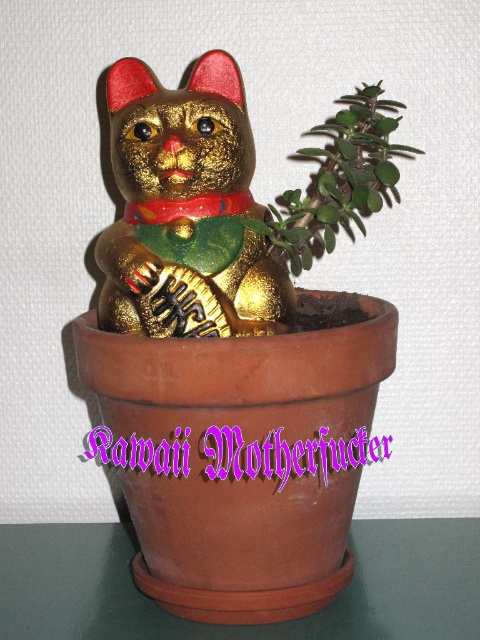
Which is more to the right, gold shiny cat at center or green matte plant at upper right?

green matte plant at upper right is more to the right.

Between point (264, 324) and point (351, 99), which one is positioned in front?

Point (264, 324)

Between point (212, 275) and point (361, 99), which one is positioned in front?

Point (212, 275) is in front.

Locate an element on the screen. gold shiny cat at center is located at coordinates (186, 209).